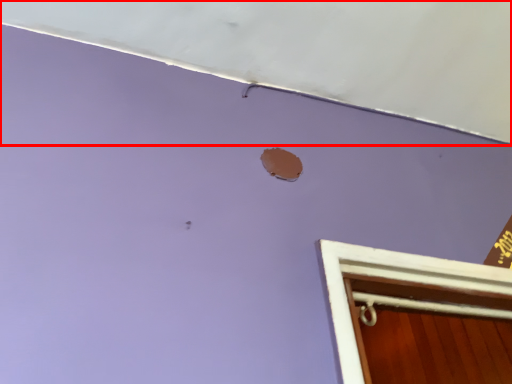
Question: From the image's perspective, considering the relative positions of exhaust hood (annotated by the red box) and hole in the image provided, where is exhaust hood (annotated by the red box) located with respect to the staircase?

Choices:
 (A) above
 (B) below

Answer: (A)